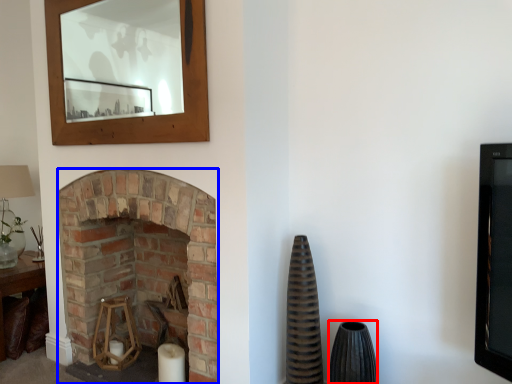
Question: Which of the following is the farthest to the observer, vase (highlighted by a red box) or fireplace (highlighted by a blue box)?

Choices:
 (A) vase
 (B) fireplace

Answer: (B)